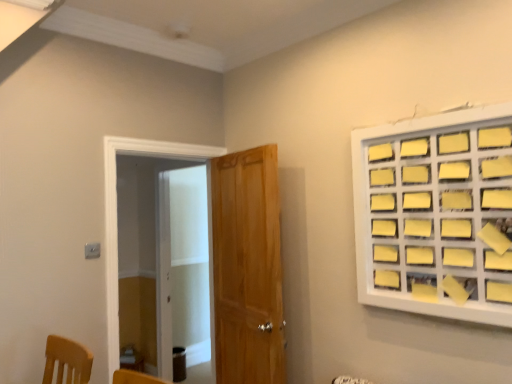
Question: From a real-world perspective, is wooden door at center positioned over yellow paper at upper right based on gravity?

Choices:
 (A) no
 (B) yes

Answer: (A)

Question: Could you tell me if wooden door at center is facing yellow paper at upper right?

Choices:
 (A) yes
 (B) no

Answer: (B)

Question: Does wooden door at center come in front of yellow paper at upper right?

Choices:
 (A) yes
 (B) no

Answer: (B)

Question: Is the depth of wooden door at center greater than that of yellow paper at upper right?

Choices:
 (A) no
 (B) yes

Answer: (B)

Question: Would you say wooden door at center is a long distance from yellow paper at upper right?

Choices:
 (A) yes
 (B) no

Answer: (B)

Question: Visually, is transparent glass screen door at left positioned to the left or to the right of yellow paper at upper right?

Choices:
 (A) right
 (B) left

Answer: (B)

Question: From the image's perspective, is transparent glass screen door at left above or below yellow paper at upper right?

Choices:
 (A) below
 (B) above

Answer: (A)

Question: Considering the positions of transparent glass screen door at left and yellow paper at upper right in the image, is transparent glass screen door at left bigger or smaller than yellow paper at upper right?

Choices:
 (A) small
 (B) big

Answer: (B)

Question: From a real-world perspective, is transparent glass screen door at left above or below yellow paper at upper right?

Choices:
 (A) above
 (B) below

Answer: (B)

Question: Looking at the image, does yellow paper at upper right seem bigger or smaller compared to transparent glass screen door at left?

Choices:
 (A) small
 (B) big

Answer: (A)

Question: Considering the relative positions of yellow paper at upper right and transparent glass screen door at left in the image provided, is yellow paper at upper right to the left or to the right of transparent glass screen door at left?

Choices:
 (A) right
 (B) left

Answer: (A)

Question: From a real-world perspective, relative to transparent glass screen door at left, is yellow paper at upper right vertically above or below?

Choices:
 (A) below
 (B) above

Answer: (B)

Question: From the image's perspective, relative to transparent glass screen door at left, is yellow paper at upper right above or below?

Choices:
 (A) above
 (B) below

Answer: (A)

Question: Do you think transparent glass screen door at left is within wooden door at center, or outside of it?

Choices:
 (A) inside
 (B) outside

Answer: (B)

Question: Considering the positions of point (205, 210) and point (223, 251), is point (205, 210) closer or farther from the camera than point (223, 251)?

Choices:
 (A) closer
 (B) farther

Answer: (B)